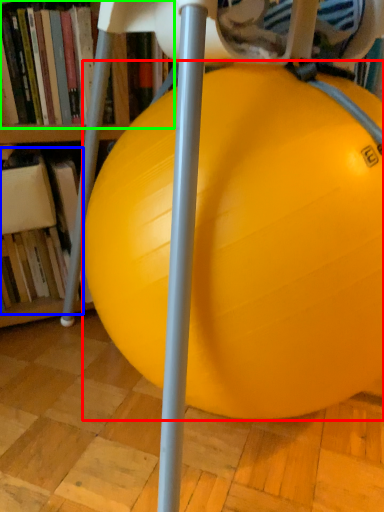
Question: Which object is positioned closest to ball (highlighted by a red box)? Select from book (highlighted by a blue box) and book (highlighted by a green box).

Choices:
 (A) book
 (B) book

Answer: (B)